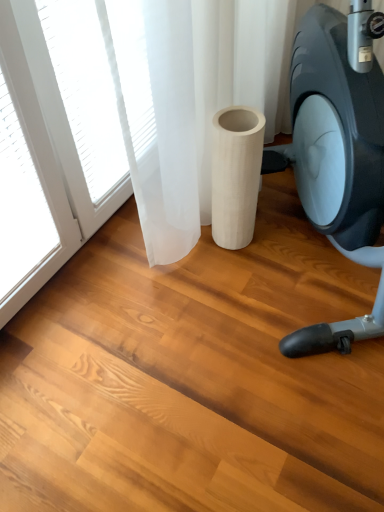
Identify the location of vacant space that's between matte black stationary bicycle at right and white wood cylinder at center. (231, 292).